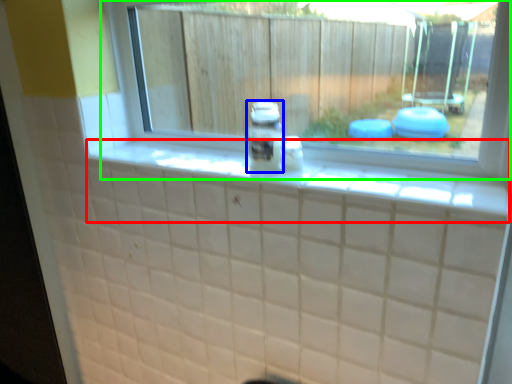
Question: Which object is the farthest from ledge (highlighted by a red box)? Choose among these: glass jar (highlighted by a blue box) or window (highlighted by a green box).

Choices:
 (A) glass jar
 (B) window

Answer: (B)